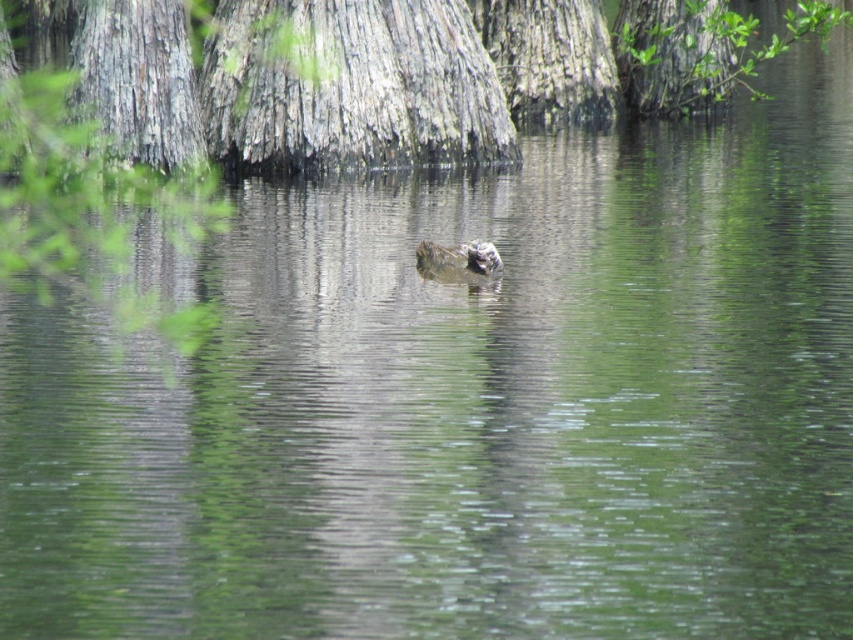
Question: Considering the real-world distances, which object is closest to the green leafy tree at upper right?

Choices:
 (A) gray textured bark at upper center
 (B) brown fuzzy duck at center

Answer: (A)

Question: In this image, where is green leafy tree at upper right located relative to brown fuzzy duck at center?

Choices:
 (A) right
 (B) left

Answer: (A)

Question: Which object is closer to the camera taking this photo?

Choices:
 (A) gray textured bark at upper center
 (B) green leafy tree at upper right

Answer: (A)

Question: Is green leafy tree at upper right smaller than brown fuzzy duck at center?

Choices:
 (A) yes
 (B) no

Answer: (B)

Question: Which object is farther from the camera taking this photo?

Choices:
 (A) brown fuzzy duck at center
 (B) green leafy tree at upper right
 (C) gray textured bark at upper center

Answer: (B)

Question: Does green leafy tree at upper right appear under brown fuzzy duck at center?

Choices:
 (A) yes
 (B) no

Answer: (B)